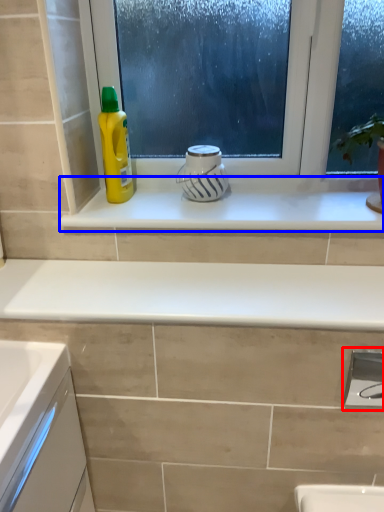
Question: Which object appears closest to the camera in this image, faucet (highlighted by a red box) or window sill (highlighted by a blue box)?

Choices:
 (A) faucet
 (B) window sill

Answer: (A)